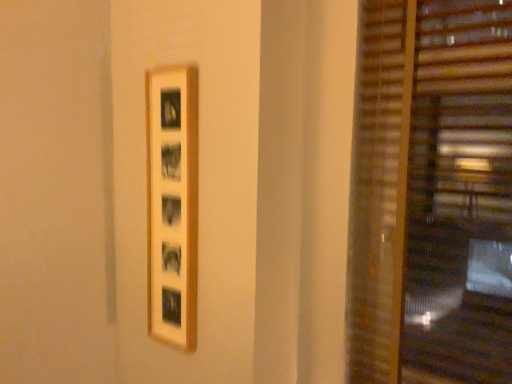
Question: Considering the relative sizes of wooden blinds at right and wooden picture frame at center in the image provided, is wooden blinds at right taller than wooden picture frame at center?

Choices:
 (A) yes
 (B) no

Answer: (A)

Question: Can you confirm if wooden blinds at right is thinner than wooden picture frame at center?

Choices:
 (A) no
 (B) yes

Answer: (A)

Question: From the image's perspective, does wooden blinds at right appear lower than wooden picture frame at center?

Choices:
 (A) no
 (B) yes

Answer: (A)

Question: Can you confirm if wooden blinds at right is bigger than wooden picture frame at center?

Choices:
 (A) no
 (B) yes

Answer: (B)

Question: Is wooden blinds at right positioned far away from wooden picture frame at center?

Choices:
 (A) no
 (B) yes

Answer: (A)

Question: Considering the relative sizes of wooden blinds at right and wooden picture frame at center in the image provided, is wooden blinds at right smaller than wooden picture frame at center?

Choices:
 (A) yes
 (B) no

Answer: (B)

Question: Considering the relative sizes of wooden picture frame at center and wooden blinds at right in the image provided, is wooden picture frame at center taller than wooden blinds at right?

Choices:
 (A) yes
 (B) no

Answer: (B)

Question: Can you confirm if wooden picture frame at center is thinner than wooden blinds at right?

Choices:
 (A) no
 (B) yes

Answer: (B)

Question: From the image's perspective, is wooden picture frame at center below wooden blinds at right?

Choices:
 (A) yes
 (B) no

Answer: (A)

Question: Is wooden picture frame at center far away from wooden blinds at right?

Choices:
 (A) no
 (B) yes

Answer: (A)

Question: Is wooden picture frame at center outside wooden blinds at right?

Choices:
 (A) no
 (B) yes

Answer: (B)

Question: Does wooden picture frame at center contain wooden blinds at right?

Choices:
 (A) yes
 (B) no

Answer: (B)

Question: From a real-world perspective, is wooden picture frame at center positioned above or below wooden blinds at right?

Choices:
 (A) below
 (B) above

Answer: (A)